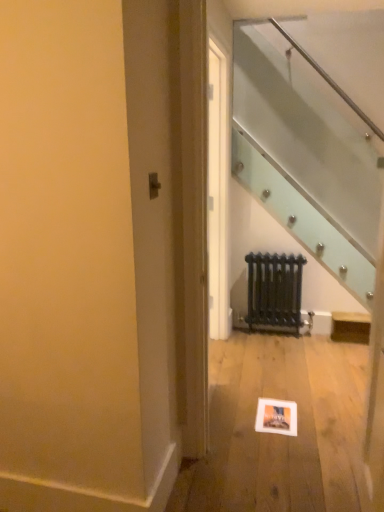
Locate an element on the screen. The height and width of the screenshot is (512, 384). free spot below black metal radiator at center (from a real-world perspective) is located at coordinates (282, 328).